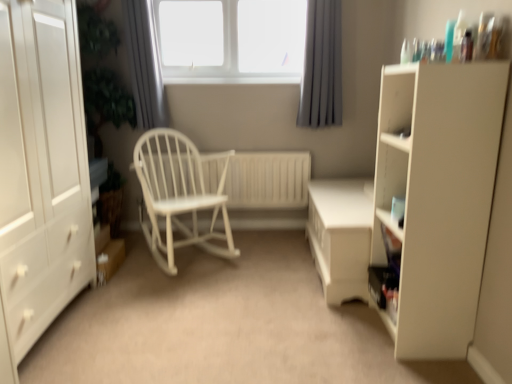
Question: Is gray fabric curtain at upper center, the 2th curtain viewed from the right, wider or thinner than white wooden radiator at center?

Choices:
 (A) thin
 (B) wide

Answer: (B)

Question: In terms of size, does gray fabric curtain at upper center, the 1th curtain viewed from the left, appear bigger or smaller than white wooden radiator at center?

Choices:
 (A) small
 (B) big

Answer: (A)

Question: Which is nearer to the white wood rocking chair at center?

Choices:
 (A) gray fabric curtain at upper center, the 2th curtain positioned from the left
 (B) white glossy table at center
 (C) white wood rocking chair at center
 (D) white plastic window at upper center
 (E) matte white cupboard at right

Answer: (B)

Question: Which is nearer to the white plastic window at upper center?

Choices:
 (A) white matte cabinet at left
 (B) white wood rocking chair at center
 (C) gray fabric curtain at upper center, the 2th curtain viewed from the right
 (D) white wood rocking chair at center
 (E) gray fabric curtain at upper center, placed as the first curtain when sorted from right to left

Answer: (C)